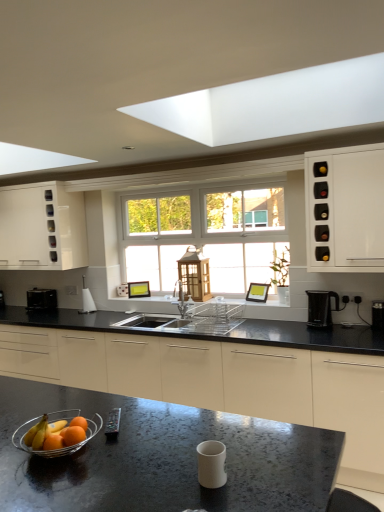
The image size is (384, 512). I want to click on free point to the right of metallic remote control at center, which ranks as the 3th appliance in left-to-right order, so click(168, 425).